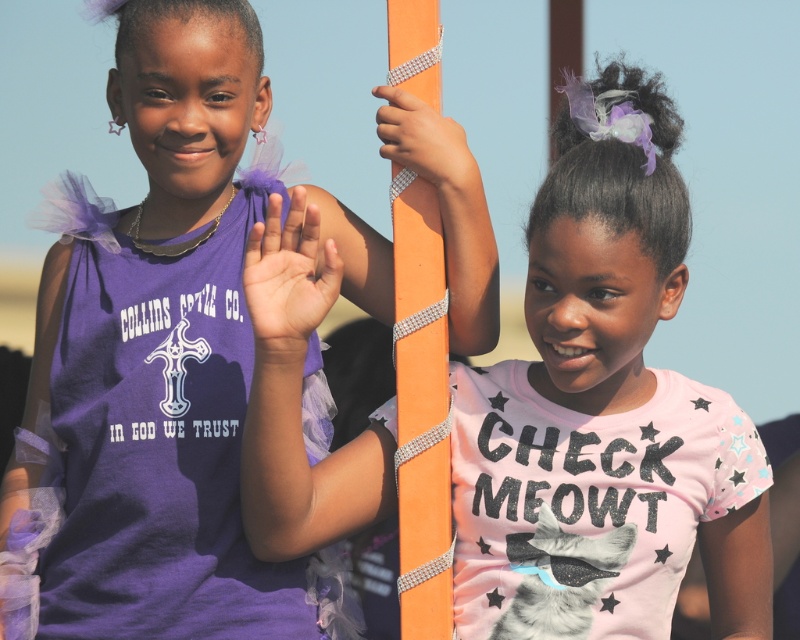
From the picture: You are a photographer trying to capture a closeup of the orange shiny pole at center. However, the matte purple hand at center is blocking your view. Can you estimate whether the pole can be seen if you move your camera slightly to the left?

The matte purple hand at center is wider than the orange shiny pole at center. Therefore, moving the camera slightly to the left might still allow you to see the pole since the hand is wider but not necessarily covering the entire pole. However, precise adjustments would depend on their exact positions.